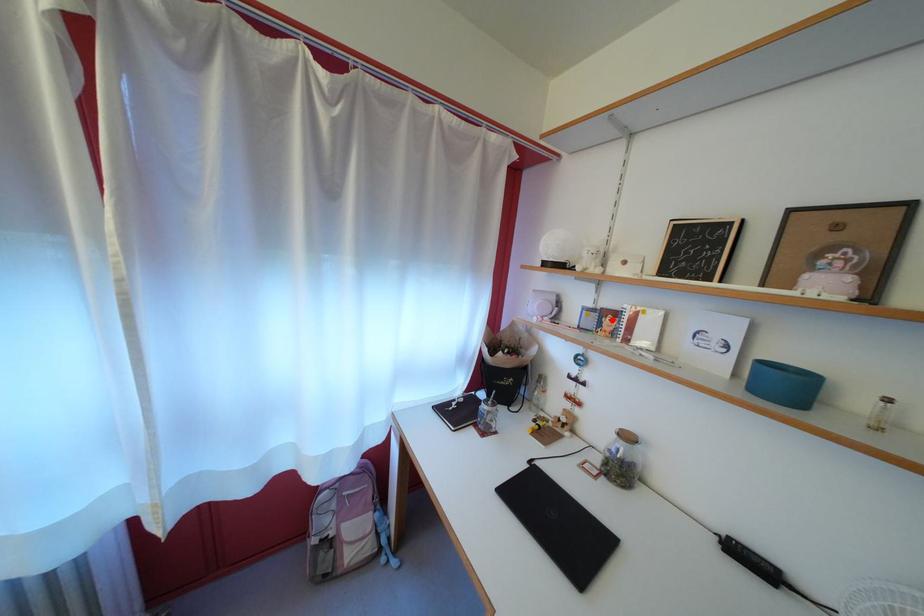
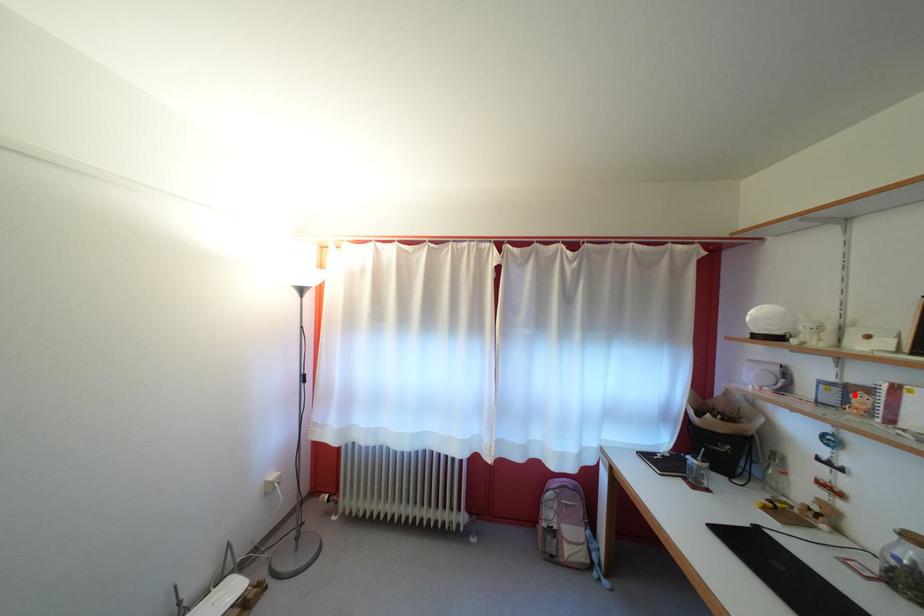
I am providing you with two images of the same scene from different viewpoints. A red point is marked on the first image and another point is marked on the second image. Does the point marked in image1 correspond to the same location as the one in image2?

Yes